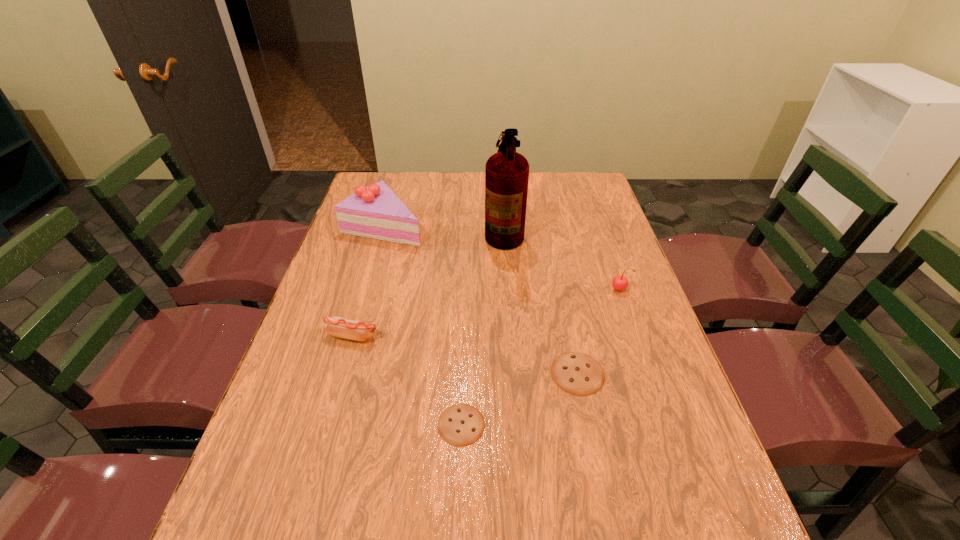
The height and width of the screenshot is (540, 960). I want to click on object that is the second closest to the shortest object, so click(337, 326).

Find the location of a particular element. The image size is (960, 540). the fourth closest object to the second tallest object is located at coordinates (461, 424).

This screenshot has height=540, width=960. Find the location of `vacant area that satisfies the following two spatial constraints: 1. on the back side of the farther cookie; 2. at the nozzle of the fire extinguisher`. vacant area that satisfies the following two spatial constraints: 1. on the back side of the farther cookie; 2. at the nozzle of the fire extinguisher is located at coordinates (549, 231).

I want to click on vacant region that satisfies the following two spatial constraints: 1. at the nozzle of the third tallest object; 2. on the left side of the third object from right to left, so click(x=508, y=290).

The width and height of the screenshot is (960, 540). What are the coordinates of `free space that satisfies the following two spatial constraints: 1. at the nozzle of the second object from right to left; 2. on the left side of the tallest object` in the screenshot? It's located at (514, 373).